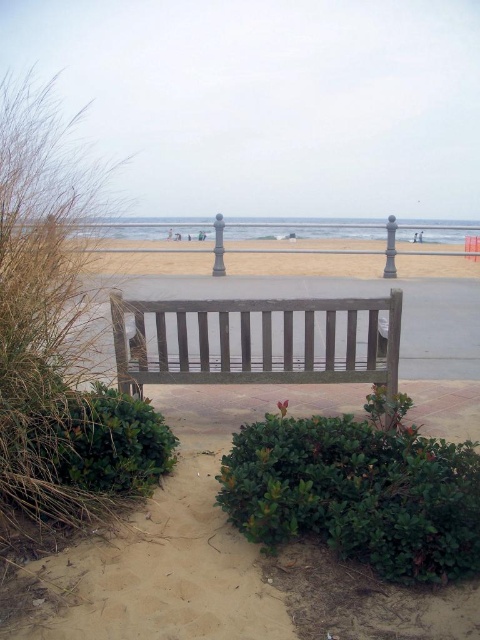
Question: Does green leafy bush at lower left have a larger size compared to beige sand at center?

Choices:
 (A) yes
 (B) no

Answer: (B)

Question: Does green leafy bush at lower center come in front of wooden bench at center?

Choices:
 (A) yes
 (B) no

Answer: (A)

Question: Which object is positioned farthest from the beige sand at center?

Choices:
 (A) wooden bench at center
 (B) green leafy bush at lower left
 (C) green leafy bush at lower center

Answer: (A)

Question: Which point appears closest to the camera in this image?

Choices:
 (A) (131, 476)
 (B) (388, 452)
 (C) (287, 364)

Answer: (A)

Question: Is green leafy bush at lower center positioned at the back of wooden bench at center?

Choices:
 (A) yes
 (B) no

Answer: (B)

Question: Among these objects, which one is farthest from the camera?

Choices:
 (A) beige sand at center
 (B) green leafy bush at lower center

Answer: (A)